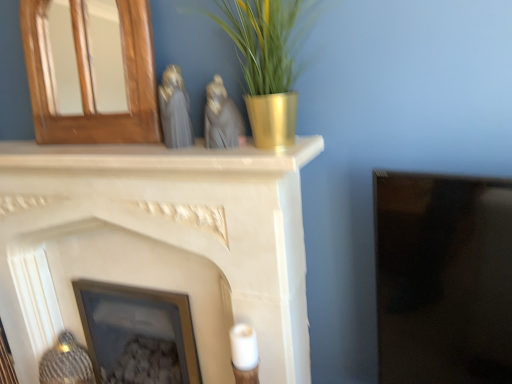
The height and width of the screenshot is (384, 512). I want to click on blank space to the left of matte gray statue at center, which is the 1th animal in right-to-left order, so click(x=168, y=145).